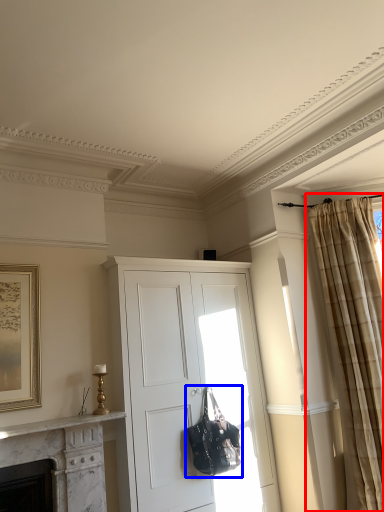
Question: Which point is closer to the camera, curtain (highlighted by a red box) or handbag (highlighted by a blue box)?

Choices:
 (A) curtain
 (B) handbag

Answer: (B)